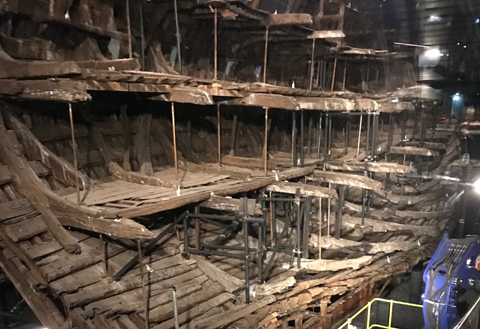
This screenshot has width=480, height=329. Identify the location of ceiling. (431, 32).